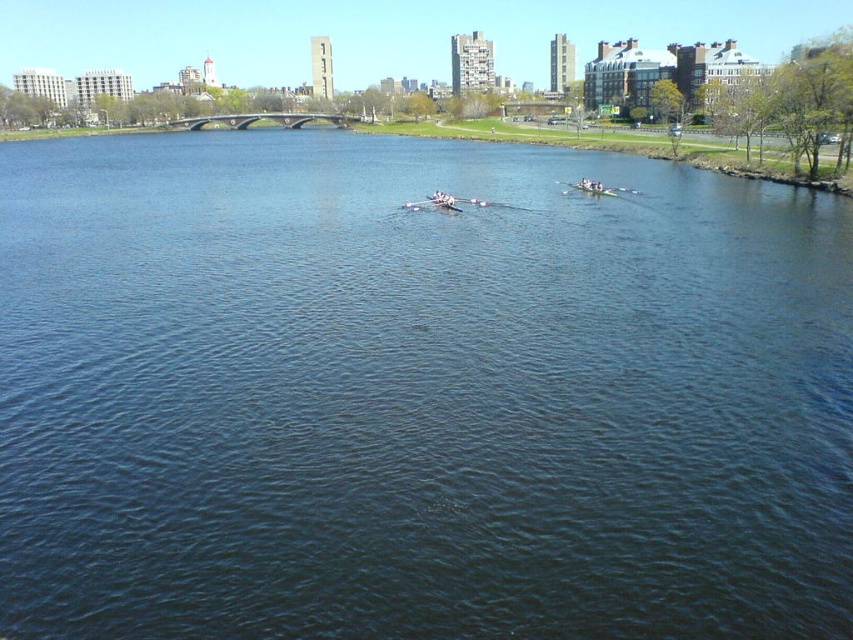
Question: Does white glossy canoe at center lie behind smooth white oar at center?

Choices:
 (A) no
 (B) yes

Answer: (B)

Question: Which object is farther from the camera taking this photo?

Choices:
 (A) smooth white oar at center
 (B) white glossy canoe at center

Answer: (B)

Question: Does white glossy canoe at center appear over smooth white oar at center?

Choices:
 (A) no
 (B) yes

Answer: (B)

Question: Can you confirm if white glossy canoe at center is positioned to the left of smooth white oar at center?

Choices:
 (A) no
 (B) yes

Answer: (A)